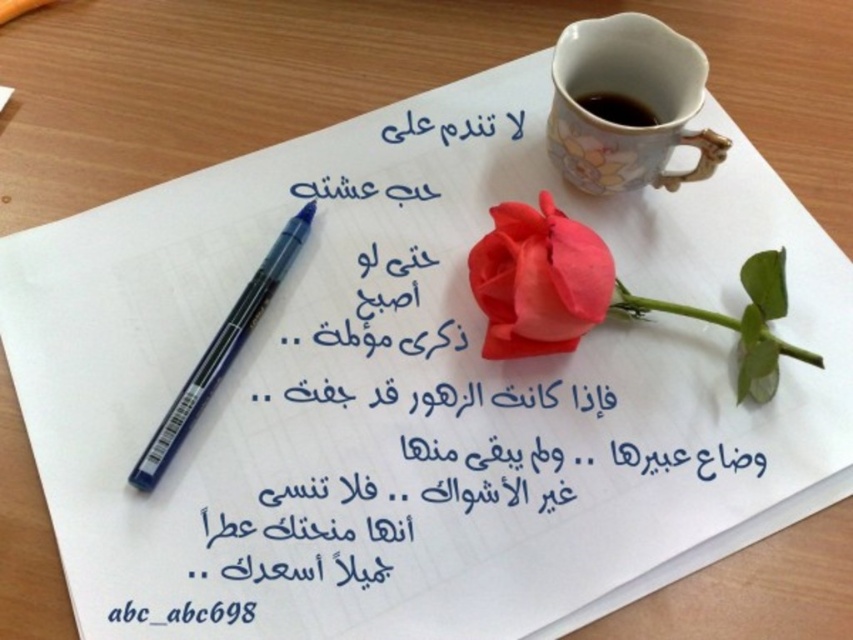
Question: Can you confirm if glossy ceramic cup at upper center is thinner than glossy ceramic mug at upper center?

Choices:
 (A) yes
 (B) no

Answer: (B)

Question: Based on their relative distances, which object is nearer to the glossy ceramic cup at upper center?

Choices:
 (A) glossy ceramic mug at upper center
 (B) matte pink rose at center

Answer: (A)

Question: Is matte pink rose at center below blue plastic pen at upper left?

Choices:
 (A) no
 (B) yes

Answer: (A)

Question: Which object is farther from the camera taking this photo?

Choices:
 (A) glossy ceramic mug at upper center
 (B) blue plastic pen at upper left
 (C) matte pink rose at center
 (D) glossy ceramic cup at upper center

Answer: (A)

Question: Among these objects, which one is farthest from the camera?

Choices:
 (A) blue plastic pen at upper left
 (B) matte pink rose at center
 (C) glossy ceramic mug at upper center
 (D) glossy ceramic cup at upper center

Answer: (C)

Question: Is glossy ceramic cup at upper center above matte pink rose at center?

Choices:
 (A) yes
 (B) no

Answer: (A)